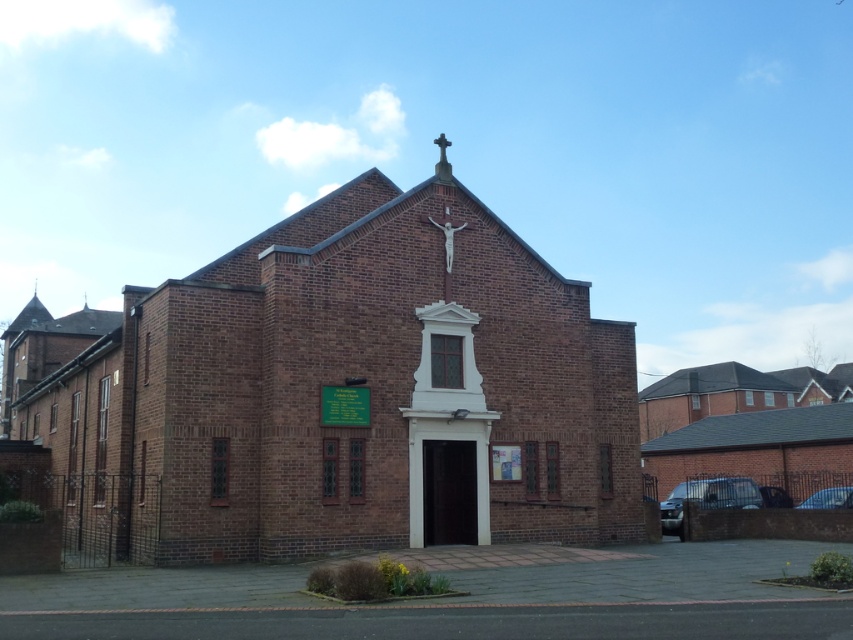
You are standing in front of the church and want to know how far you are from the point marked as point (590, 380). Can you determine the distance?

The distance between you and point (590, 380) is 42.17 meters.

Consider the image. You are standing at the point with coordinates (344, 388) in the image of the church. What object are you directly facing?

The point at coordinates (344, 388) corresponds to the brown brick church at center, so you are directly facing the brown brick church at center.